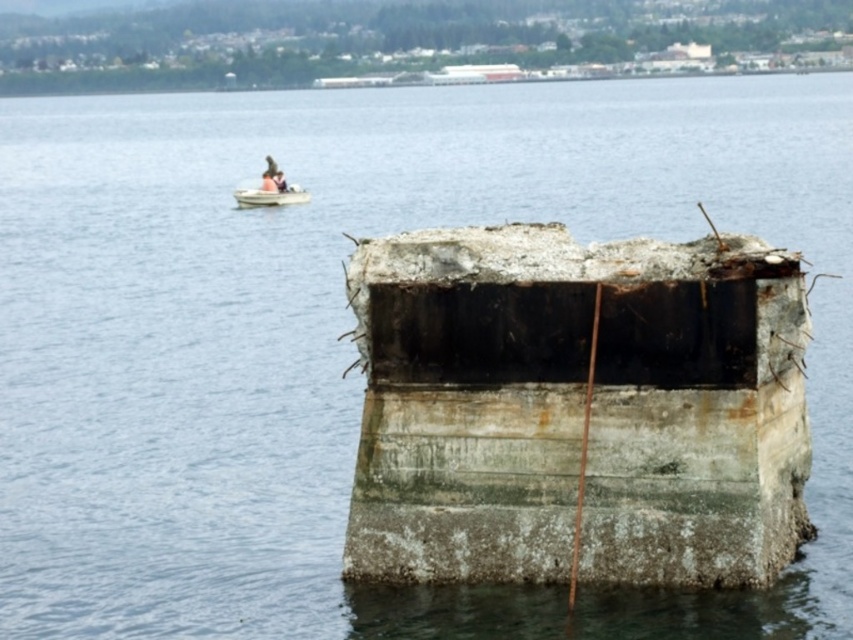
Does rusty concrete dock at center come behind light brown wooden boat at upper left?

No, it is not.

Which is behind, point (735, 388) or point (267, 180)?

Positioned behind is point (267, 180).

Identify the location of rusty concrete dock at center. (577, 408).

Can you confirm if rusty concrete dock at center is positioned below white plastic boat at upper left?

Yes.

Describe the element at coordinates (577, 408) in the screenshot. I see `rusty concrete dock at center` at that location.

This screenshot has width=853, height=640. I want to click on rusty concrete dock at center, so [x=577, y=408].

Is white plastic boat at upper left positioned in front of light brown wooden boat at upper left?

Yes, white plastic boat at upper left is closer to the viewer.

Which is in front, point (277, 204) or point (263, 179)?

Point (277, 204) is more forward.

Describe the element at coordinates (270, 196) in the screenshot. The height and width of the screenshot is (640, 853). I see `white plastic boat at upper left` at that location.

This screenshot has width=853, height=640. What are the coordinates of `white plastic boat at upper left` in the screenshot? It's located at (270, 196).